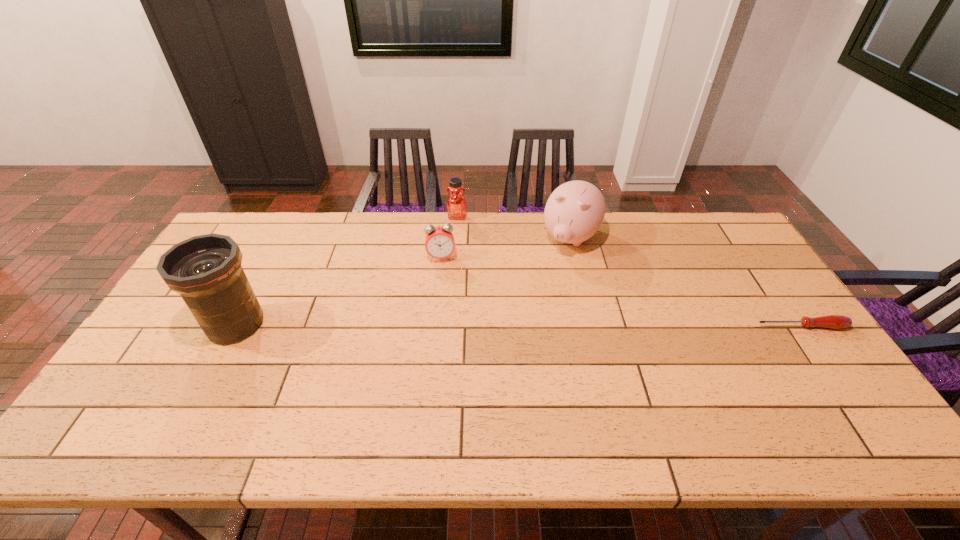
Locate an element on the screen. Image resolution: width=960 pixels, height=540 pixels. free space on the desktop that is between the tallest object and the screwdriver and is positioned at the snout of the fourth object from left to right is located at coordinates (518, 326).

The height and width of the screenshot is (540, 960). Find the location of `free space on the desktop that is between the tallest object and the shortest object and is positioned on the front label of the honey`. free space on the desktop that is between the tallest object and the shortest object and is positioned on the front label of the honey is located at coordinates pyautogui.click(x=443, y=325).

Where is `free spot on the desktop that is between the tallest object and the rightmost object and is positioned on the front-facing side of the alarm clock`? The height and width of the screenshot is (540, 960). free spot on the desktop that is between the tallest object and the rightmost object and is positioned on the front-facing side of the alarm clock is located at coordinates (447, 325).